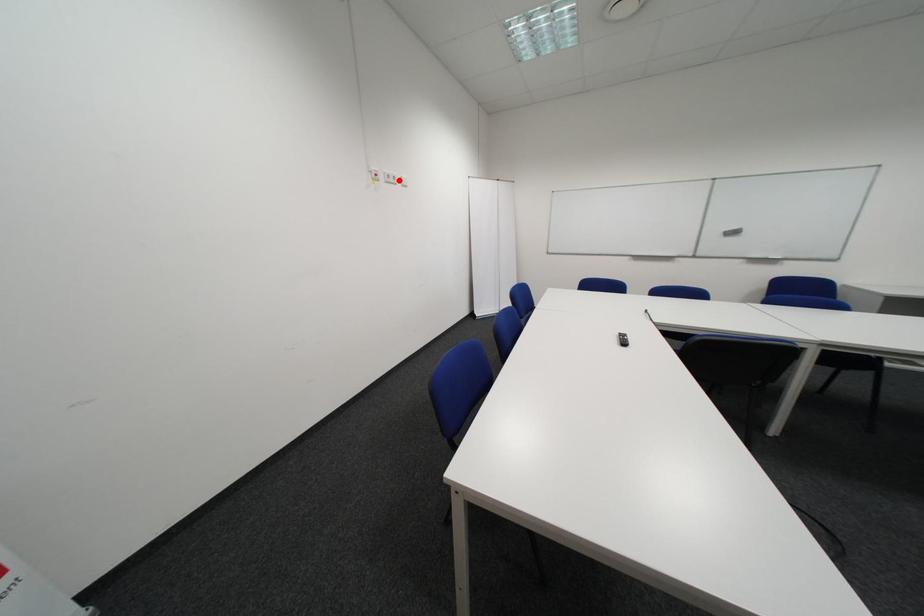
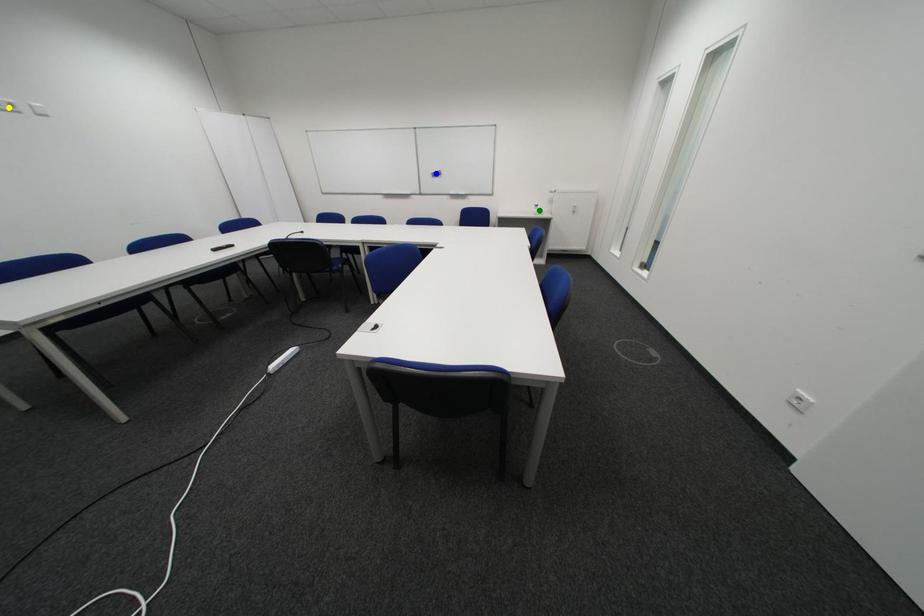
Question: I am providing you with two images of the same scene from different viewpoints. A red point is marked on the first image. You are given multiple points on the second image. Which point in image 2 represents the same 3d spot as the red point in image 1?

Choices:
 (A) green point
 (B) blue point
 (C) yellow point

Answer: (C)